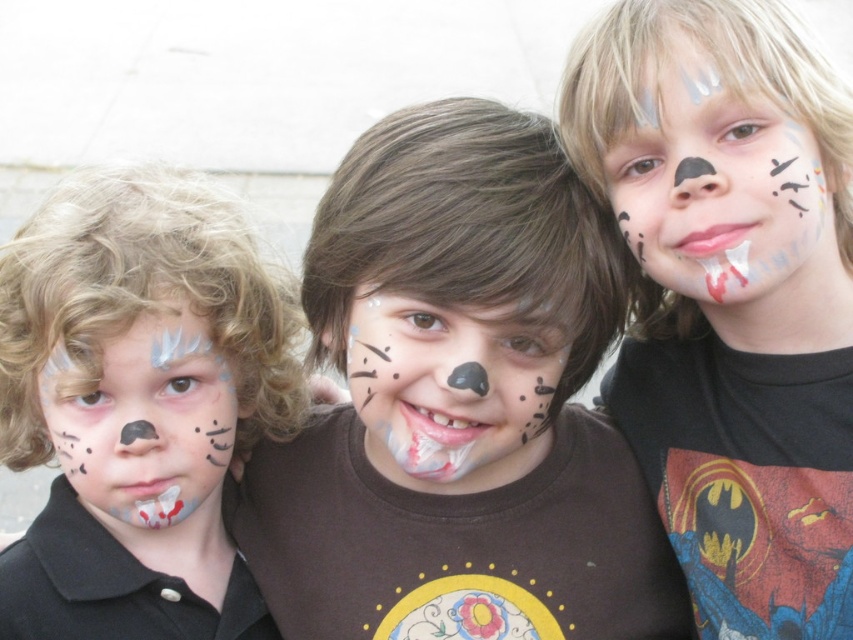
Question: Which of these objects is positioned closest to the white matte face paint at upper right?

Choices:
 (A) matte black face paint at center
 (B) matte black face paint at left

Answer: (A)

Question: Can you confirm if matte black face paint at center is smaller than matte black face paint at left?

Choices:
 (A) no
 (B) yes

Answer: (A)

Question: Which is nearer to the white matte face paint at center?

Choices:
 (A) matte brown shirt at center
 (B) white matte face paint at upper right
 (C) matte black face paint at left
 (D) matte white face paint at left

Answer: (A)

Question: Does matte black face paint at center appear under matte white face paint at left?

Choices:
 (A) yes
 (B) no

Answer: (B)

Question: Among these points, which one is farthest from the camera?

Choices:
 (A) (120, 182)
 (B) (96, 394)
 (C) (344, 230)

Answer: (A)

Question: Does matte black face paint at center appear over white matte face paint at upper right?

Choices:
 (A) yes
 (B) no

Answer: (B)